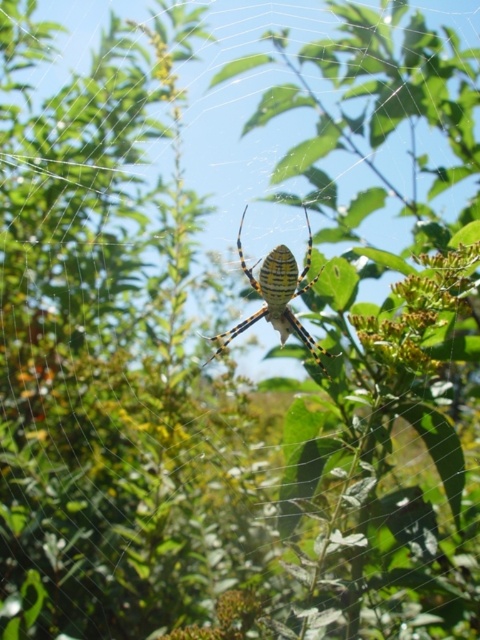
Is yellow-green textured flower at center-right wider than yellow striped spider at center?

Incorrect, yellow-green textured flower at center-right's width does not surpass yellow striped spider at center's.

Does point (454, 256) lie in front of point (261, 292)?

Yes, it is in front of point (261, 292).

Is point (409, 342) closer to camera compared to point (272, 282)?

Yes, it is.

Image resolution: width=480 pixels, height=640 pixels. I want to click on yellow-green textured flower at center-right, so click(420, 310).